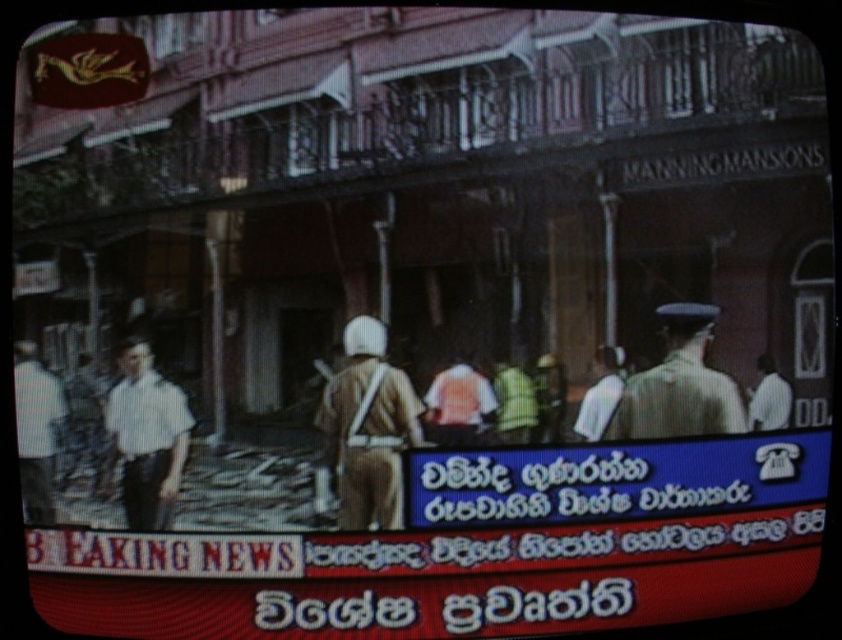
Question: Is light brown uniform at center wider than white cotton shirt at left?

Choices:
 (A) no
 (B) yes

Answer: (B)

Question: Is light brown uniform at center smaller than white shirt at left?

Choices:
 (A) no
 (B) yes

Answer: (A)

Question: Can you confirm if white cotton shirt at left is positioned below white shirt at left?

Choices:
 (A) yes
 (B) no

Answer: (B)

Question: Which point is farther to the camera?

Choices:
 (A) light brown uniform at center
 (B) brown fabric uniform at center
 (C) white cotton shirt at left

Answer: (A)

Question: Which object is closer to the camera taking this photo?

Choices:
 (A) white cotton shirt at left
 (B) light brown uniform at center
 (C) brown fabric uniform at center
 (D) white shirt at left

Answer: (C)

Question: Considering the real-world distances, which object is farthest from the brown fabric uniform at center?

Choices:
 (A) light brown uniform at center
 (B) white shirt at left
 (C) white cotton shirt at left

Answer: (B)